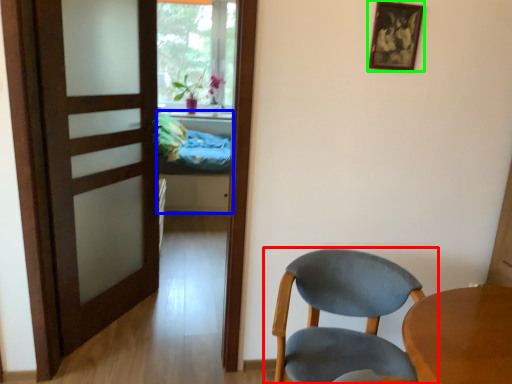
Question: Estimate the real-world distances between objects in this image. Which object is closer to chair (highlighted by a red box), bed (highlighted by a blue box) or picture frame (highlighted by a green box)?

Choices:
 (A) bed
 (B) picture frame

Answer: (B)